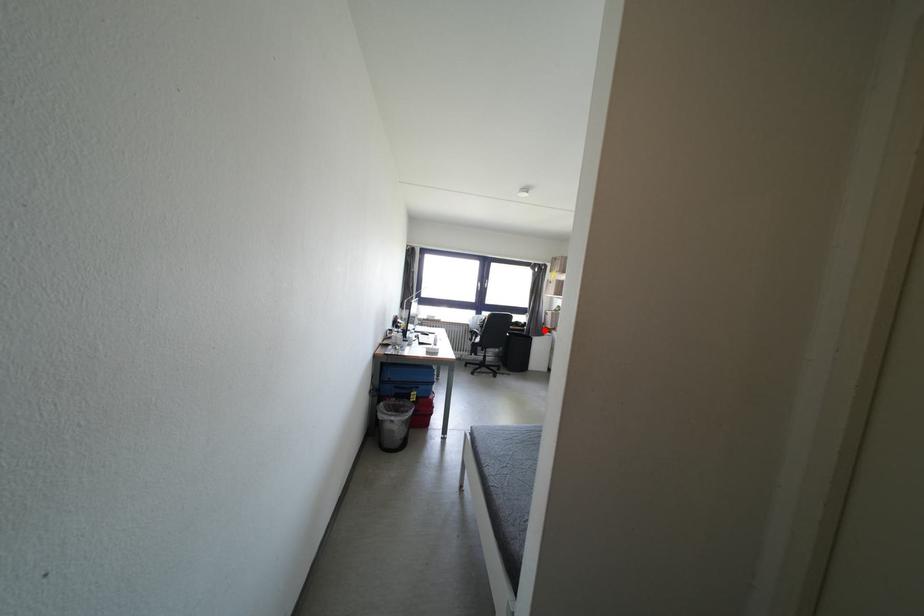
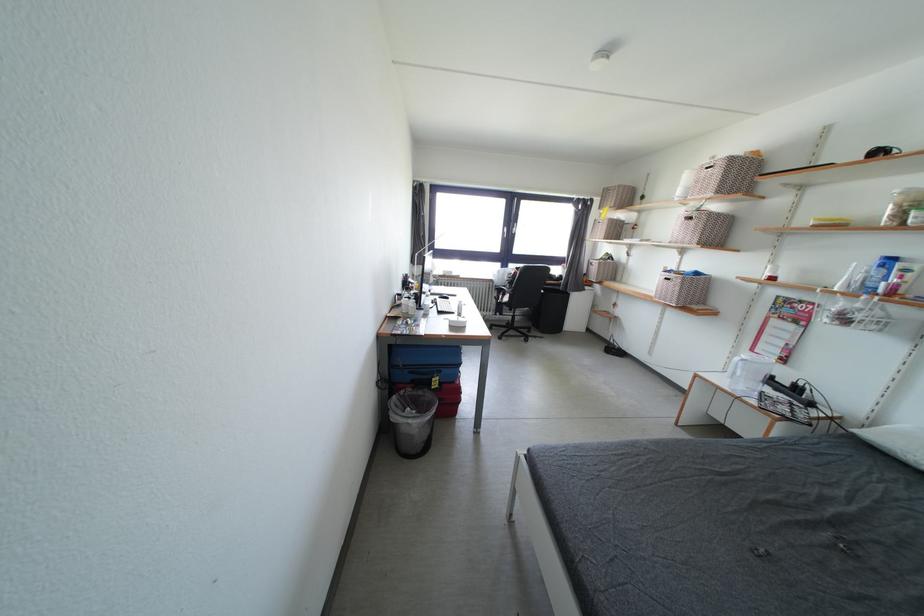
Question: A red point is marked in image1. In image2, is the corresponding 3D point closer to the camera or farther? Reply with the corresponding letter.

Choices:
 (A) The corresponding 3D point is closer.
 (B) The corresponding 3D point is farther.

Answer: (A)